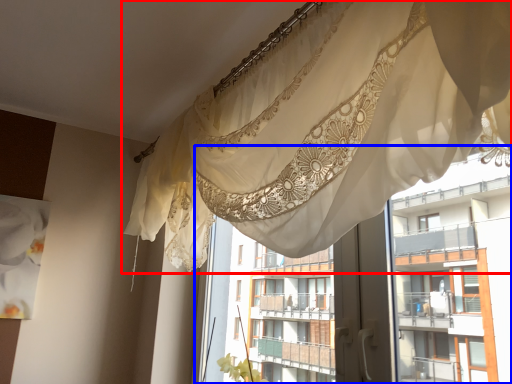
Question: Among these objects, which one is nearest to the camera, curtain (highlighted by a red box) or residence (highlighted by a blue box)?

Choices:
 (A) curtain
 (B) residence

Answer: (A)